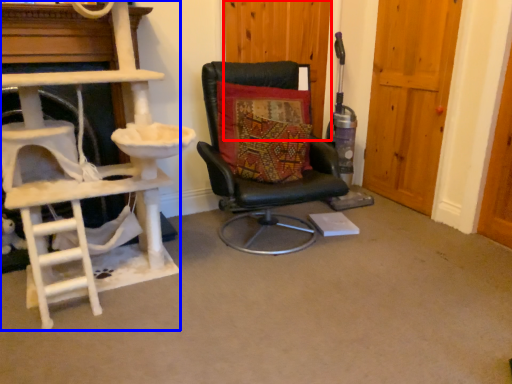
Question: Which point is closer to the camera, door (highlighted by a red box) or ladder (highlighted by a blue box)?

Choices:
 (A) door
 (B) ladder

Answer: (B)